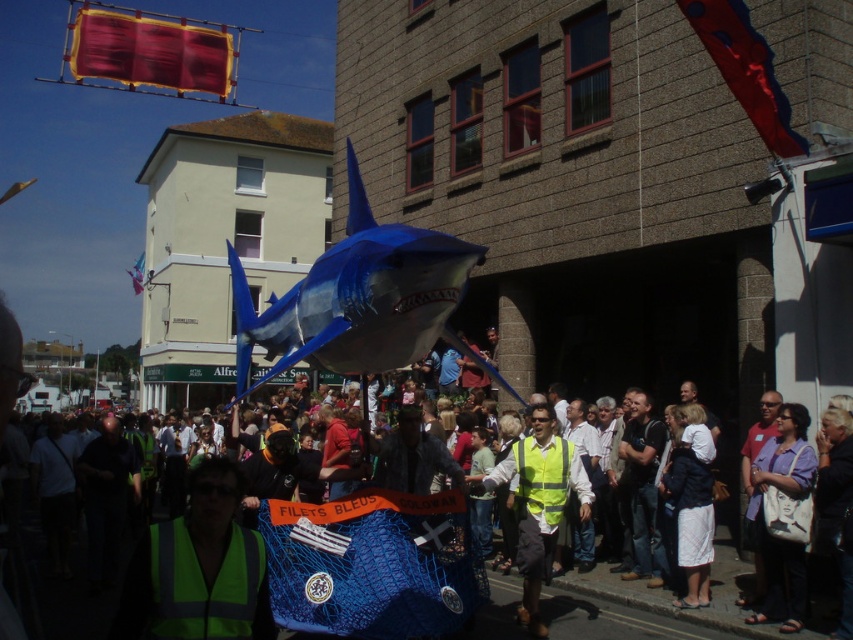
Can you confirm if shiny blue shark at center is smaller than yellow reflective vest at center?

No.

Which is more to the right, shiny blue shark at center or yellow reflective vest at center?

yellow reflective vest at center is more to the right.

Is point (241, 307) closer to viewer compared to point (534, 609)?

No.

At what (x,y) coordinates should I click in order to perform the action: click on shiny blue shark at center. Please return your answer as a coordinate pair (x, y). The width and height of the screenshot is (853, 640). Looking at the image, I should click on (357, 298).

Does green reflective vest at center have a smaller size compared to matte purple shirt at center?

Indeed, green reflective vest at center has a smaller size compared to matte purple shirt at center.

Looking at this image, who is positioned more to the right, green reflective vest at center or matte purple shirt at center?

matte purple shirt at center

Is point (186, 531) closer to viewer compared to point (757, 483)?

Yes, point (186, 531) is in front of point (757, 483).

Where is `green reflective vest at center`? This screenshot has height=640, width=853. green reflective vest at center is located at coordinates (198, 570).

Between point (244, 284) and point (780, 452), which one is positioned in front?

Point (244, 284)

Looking at this image, which of these two, shiny blue shark at center or matte purple shirt at center, stands taller?

shiny blue shark at center is taller.

Is point (334, 355) positioned behind point (792, 544)?

No.

The height and width of the screenshot is (640, 853). What are the coordinates of `shiny blue shark at center` in the screenshot? It's located at click(x=357, y=298).